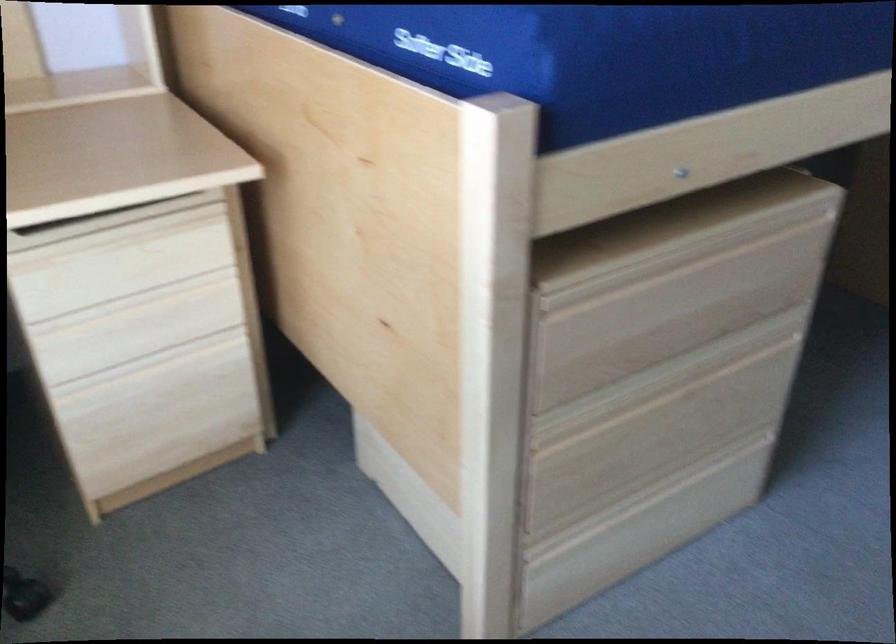
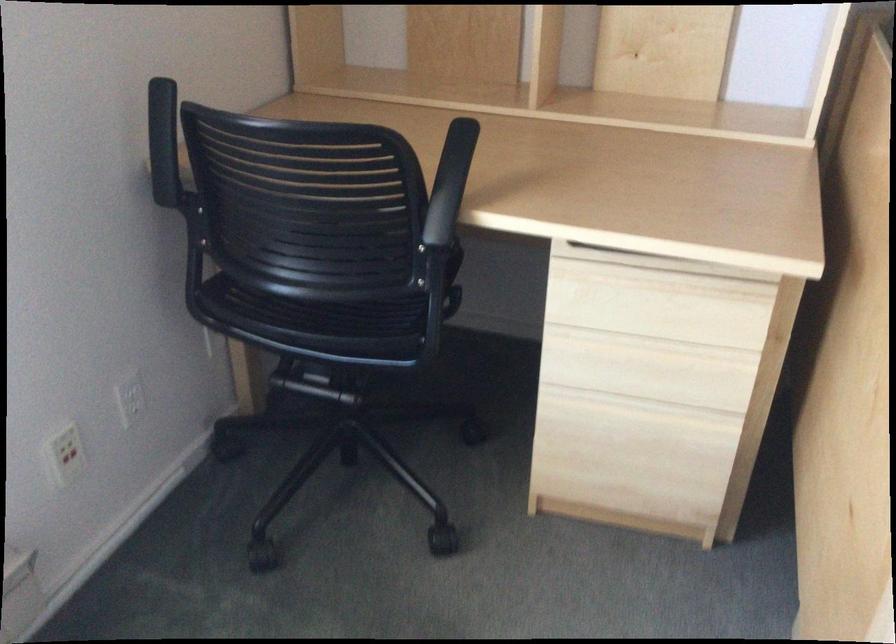
In the second image, find the point that corresponds to (x=151, y=368) in the first image.

(632, 409)